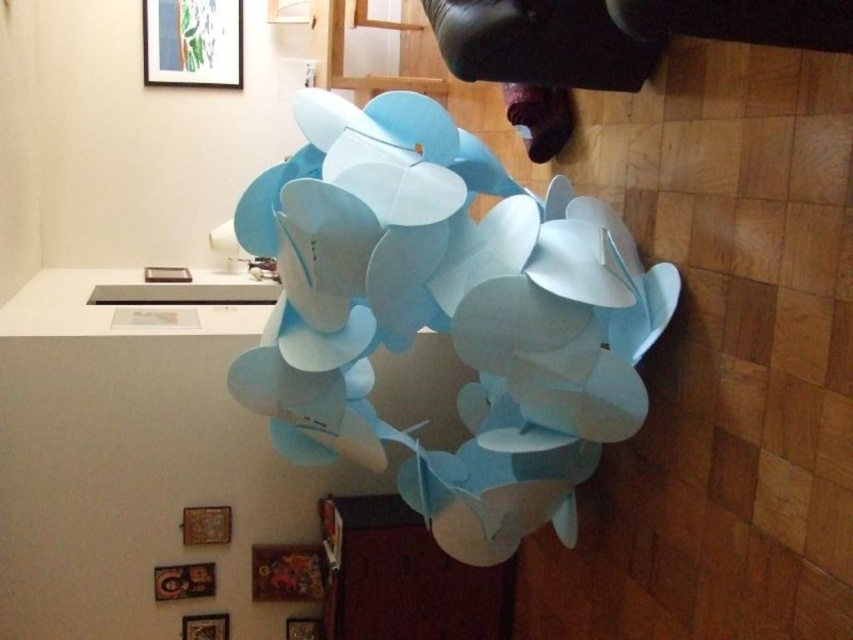
You are an interior designer assessing the space. You notice the light blue paper at center and the matte white frame at upper center. Which object is closer to the viewer?

The light blue paper at center is closer to the viewer because it is in front of the matte white frame at upper center.

You are an interior designer assessing the placement of the light blue paper at center and the matte white frame at upper center. Based on their positions, which object is closer to the ceiling?

The matte white frame at upper center is closer to the ceiling since it is positioned above the light blue paper at center.